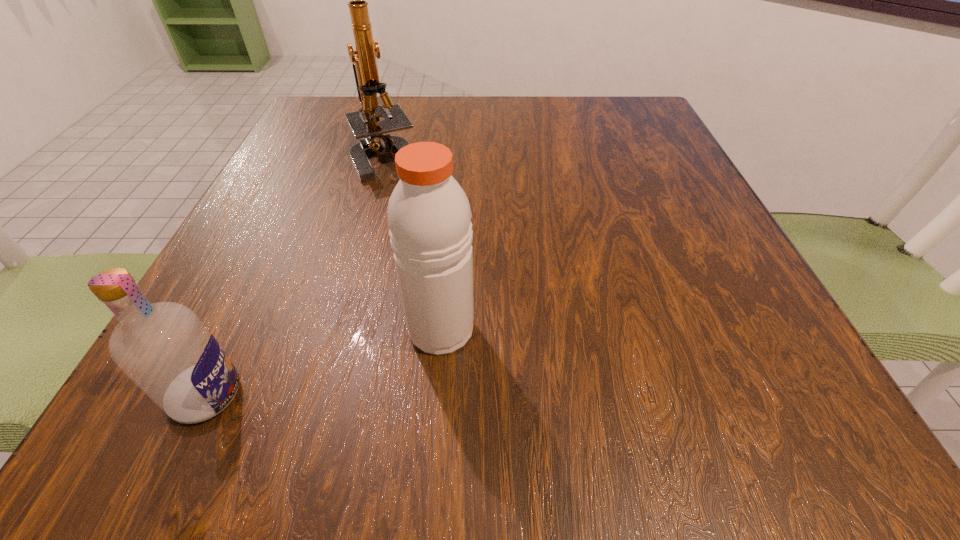
You are a GUI agent. You are given a task and a screenshot of the screen. Output one action in this format:
    pyautogui.click(x=<x>, y=<y>)
    Task: Click on the vacant space at the near left corner
    
    Given the screenshot: What is the action you would take?
    pyautogui.click(x=161, y=420)

Identify the location of vacant area at the far right corner. (636, 98).

Identify the location of vacant region at the near right corner of the desktop. The width and height of the screenshot is (960, 540). (724, 427).

You are a GUI agent. You are given a task and a screenshot of the screen. Output one action in this format:
    pyautogui.click(x=<x>, y=<y>)
    Task: Click on the empty space between the leftmost object and the second nearest object
    The height and width of the screenshot is (540, 960).
    Given the screenshot: What is the action you would take?
    pyautogui.click(x=324, y=362)

The height and width of the screenshot is (540, 960). What are the coordinates of `free space between the farthest object and the nearest object` in the screenshot? It's located at (297, 276).

The height and width of the screenshot is (540, 960). What are the coordinates of `free spot between the second object from right to left and the nearest object` in the screenshot? It's located at (297, 276).

In order to click on empty space between the vodka and the rightmost object in this screenshot , I will do `click(324, 362)`.

I want to click on free spot between the nearest object and the second nearest object, so click(324, 362).

Locate an element on the screen. empty location between the leftmost object and the farthest object is located at coordinates (297, 276).

Find the location of `free space between the shortest object and the rightmost object`. free space between the shortest object and the rightmost object is located at coordinates (324, 362).